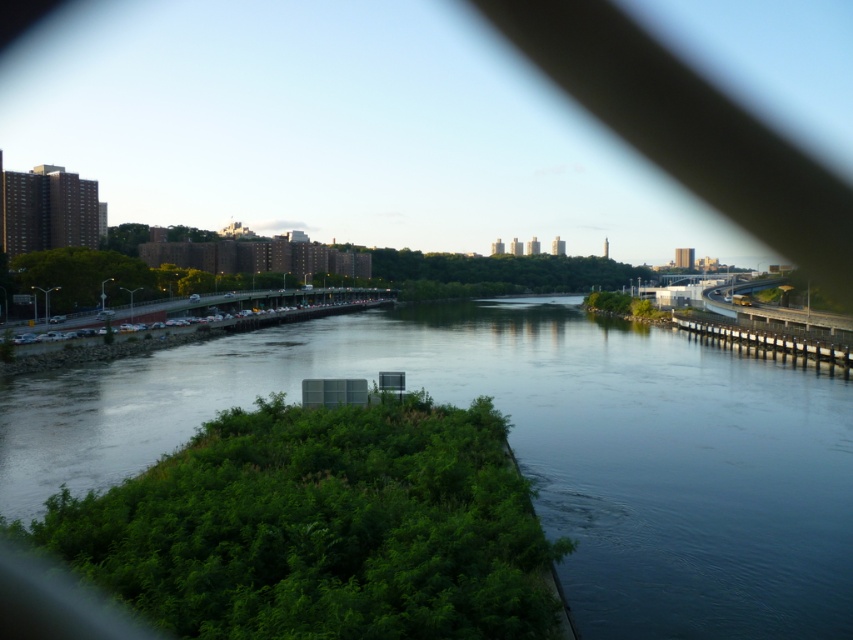
Question: Which object is farther from the camera taking this photo?

Choices:
 (A) concrete bridge at right
 (B) dark blue water at center

Answer: (A)

Question: Among these objects, which one is nearest to the camera?

Choices:
 (A) concrete bridge at right
 (B) dark blue water at center

Answer: (B)

Question: Is dark blue water at center wider than concrete bridge at right?

Choices:
 (A) no
 (B) yes

Answer: (B)

Question: Does dark blue water at center have a greater width compared to concrete bridge at right?

Choices:
 (A) yes
 (B) no

Answer: (A)

Question: Is dark blue water at center positioned in front of concrete bridge at right?

Choices:
 (A) no
 (B) yes

Answer: (B)

Question: Which point appears farthest from the camera in this image?

Choices:
 (A) (788, 330)
 (B) (808, 612)

Answer: (A)